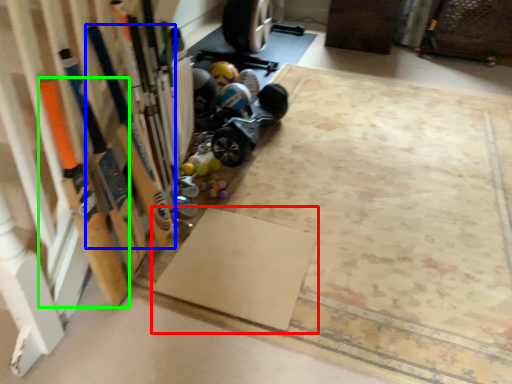
Question: Which object is the farthest from yoga mat (highlighted by a red box)? Choose among these: baseball bat (highlighted by a blue box) or baseball bat (highlighted by a green box).

Choices:
 (A) baseball bat
 (B) baseball bat

Answer: (B)